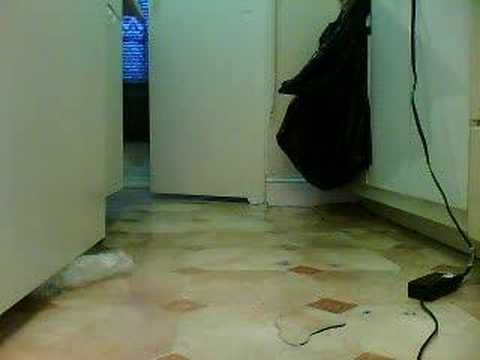
Where is `the left white cabinet`? the left white cabinet is located at coordinates (55, 144).